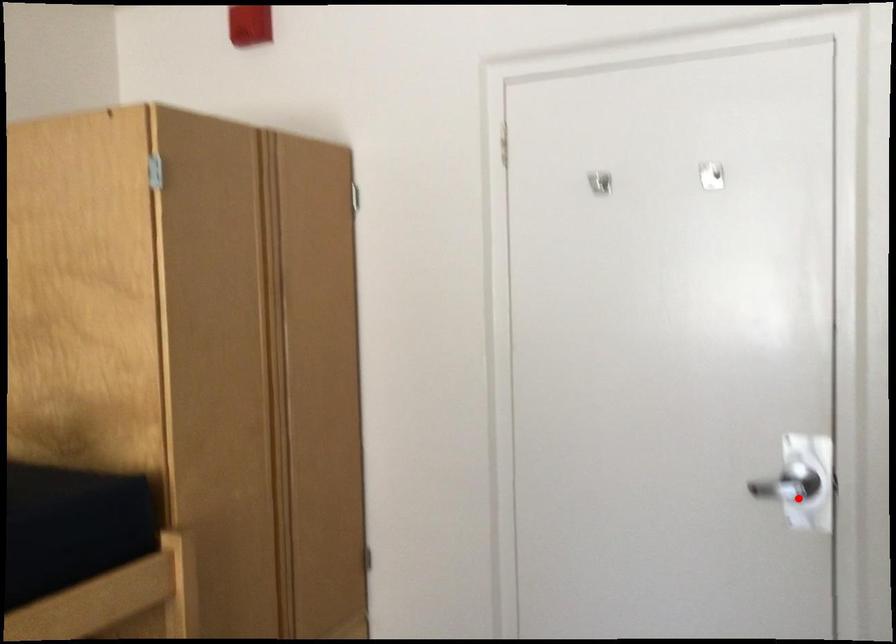
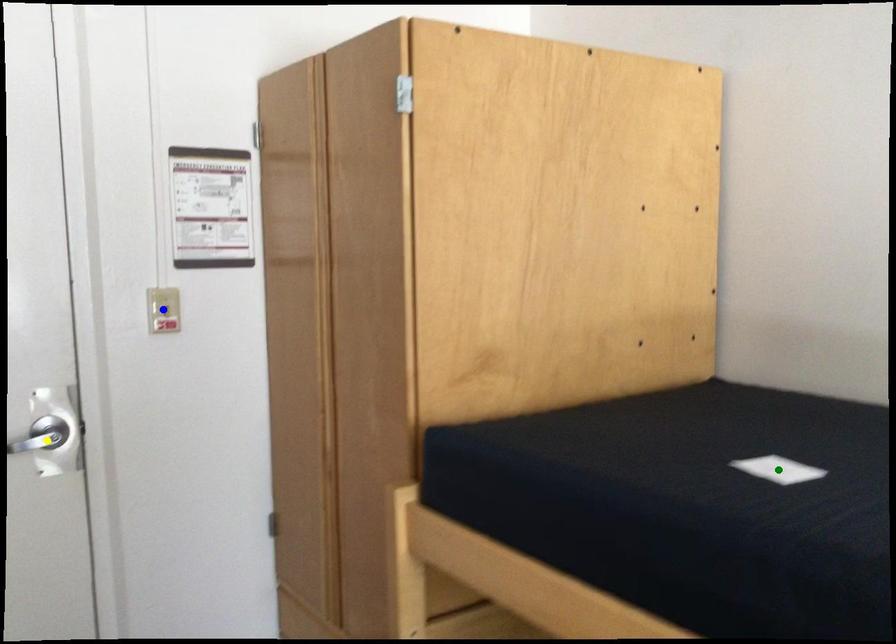
Question: I am providing you with two images of the same scene from different viewpoints. A red point is marked on the first image. You are given multiple points on the second image. Which point in image 2 is actually the same real-world point as the red point in image 1?

Choices:
 (A) blue point
 (B) green point
 (C) yellow point

Answer: (C)